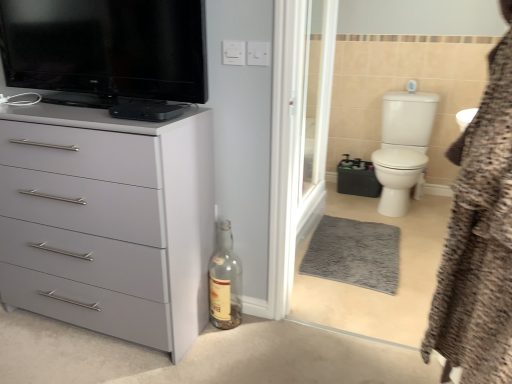
The width and height of the screenshot is (512, 384). I want to click on free spot in front of white glossy toilet bowl at right, so click(x=416, y=234).